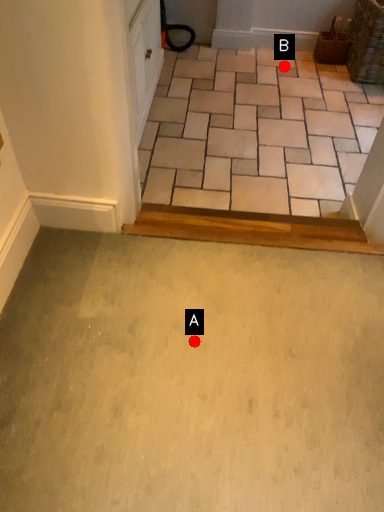
Question: Two points are circled on the image, labeled by A and B beside each circle. Which point is farther to the camera?

Choices:
 (A) A is further
 (B) B is further

Answer: (B)